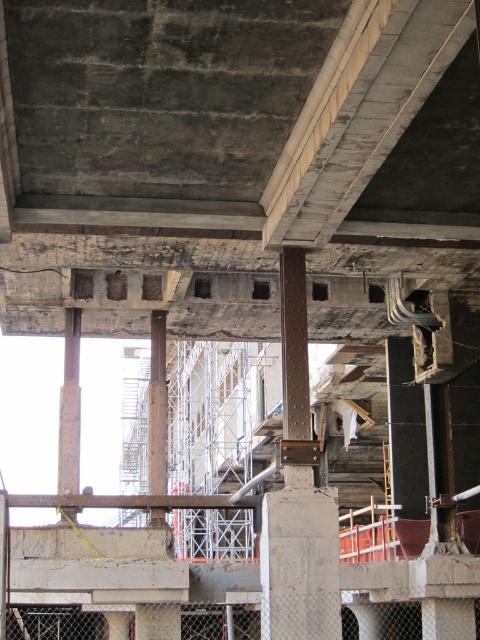
Question: Is concrete/rough at center thinner than rusty metal pillar at center?

Choices:
 (A) yes
 (B) no

Answer: (B)

Question: Can you confirm if concrete/rough at center is positioned below rusty metal pillar at center?

Choices:
 (A) no
 (B) yes

Answer: (A)

Question: In this image, where is concrete/rough at center located relative to rusty metal pillar at center?

Choices:
 (A) right
 (B) left

Answer: (A)

Question: Which of the following is the closest to the observer?

Choices:
 (A) (66, 342)
 (B) (328, 76)

Answer: (B)

Question: Which point appears farthest from the camera in this image?

Choices:
 (A) (70, 406)
 (B) (456, 266)

Answer: (A)